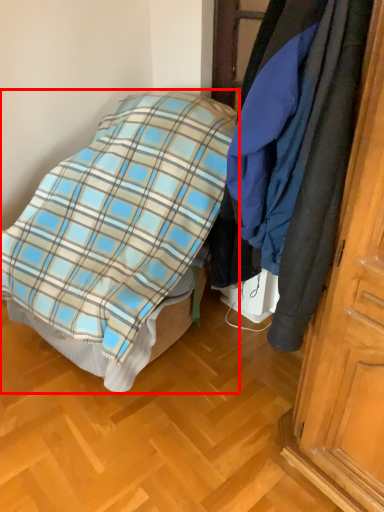
Question: From the image's perspective, what is the correct spatial relationship of bed (annotated by the red box) in relation to cloak?

Choices:
 (A) below
 (B) above

Answer: (A)